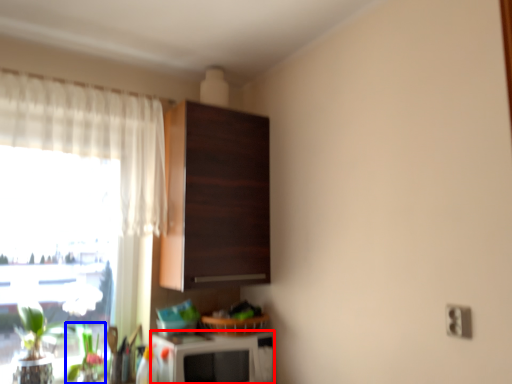
Question: Which object is closer to the camera taking this photo, appliance (highlighted by a red box) or plant (highlighted by a blue box)?

Choices:
 (A) appliance
 (B) plant

Answer: (A)